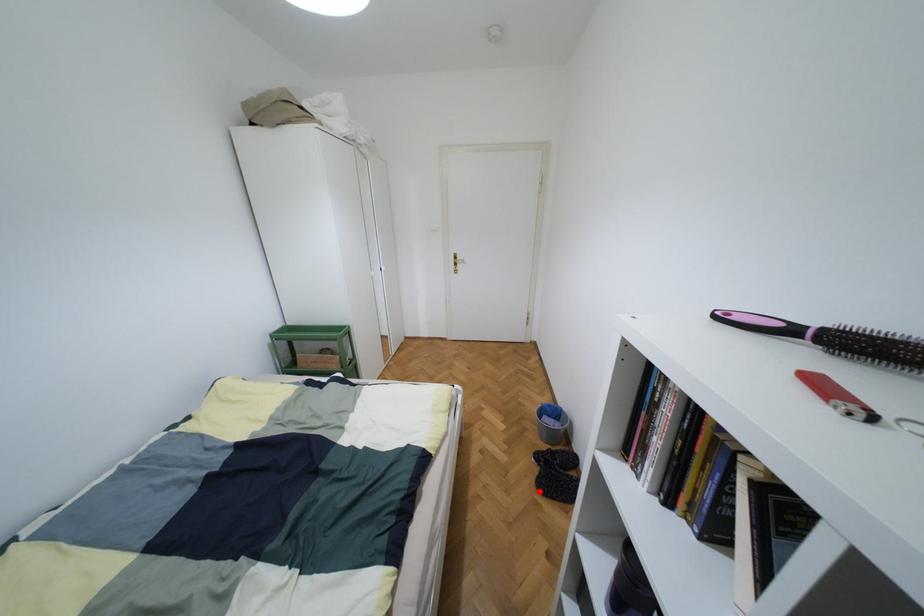
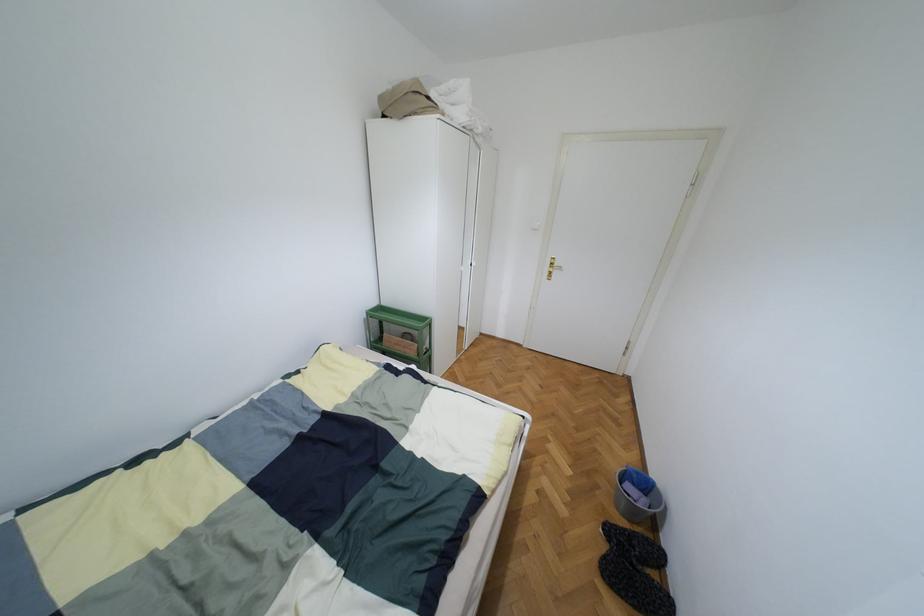
Question: I am providing you with two images of the same scene from different viewpoints. In image1, a red point is highlighted. Considering the same 3D point in image2, which of the following is correct?

Choices:
 (A) It is closer
 (B) It is farther

Answer: (A)